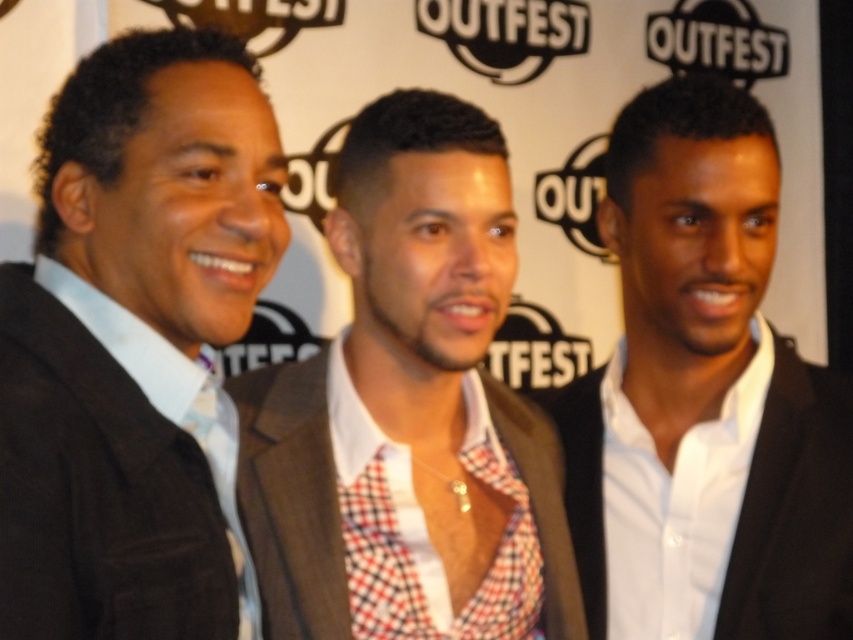
You are a photographer at the Outfest Film Festival. You need to position two people so that they are exactly 1 meter apart for a group photo. The two people are the man on the left and the checkered fabric shirt at center. Based on their current positions, will you need to move them closer or farther apart to achieve the desired distance?

The man on the left and the checkered fabric shirt at center are currently 94.41 centimeters apart. Since 94.41 cm is less than 1 meter, you need to move them farther apart to reach the desired distance of 1 meter.

You are standing 30 inches away from the backdrop. Can you reach the point at coordinates point (154, 188) on the backdrop?

The point at coordinates point (154, 188) is 29.96 inches from the viewer. Since you are standing 30 inches away, you can just barely reach it.

You are a photographer at the Outfest event and need to position two subjects for a photo. The subjects are wearing the matte black suit at left and the white glossy suit at center. According to the scene description, which subject should stand on the left side of the photo to match their current positions?

The matte black suit at left should stand on the left side of the photo because it is already positioned to the left of the white glossy suit at center in the current scene.